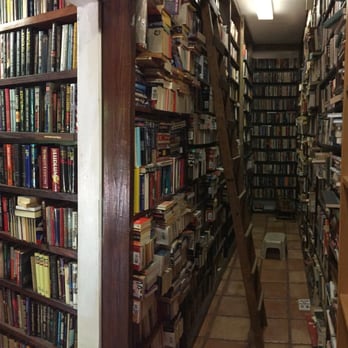
This screenshot has width=348, height=348. Identify the location of tile. (233, 311).